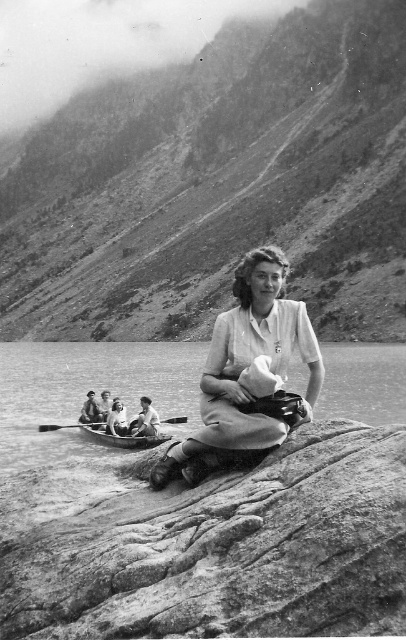
You are standing at the edge of the lake and see the rough textured rock at lower center and the wooden paddle at center. Which object is positioned to the right of the other?

The rough textured rock at lower center is positioned to the right of the wooden paddle at center.

You are a photographer who wants to capture a closeup of the wooden paddle at center without the wooden canoe at center blocking it. Is it possible to adjust your camera angle to achieve this?

The wooden canoe at center is above the wooden paddle at center, so adjusting the camera angle downward might allow you to capture the wooden paddle at center without the canoe blocking it.